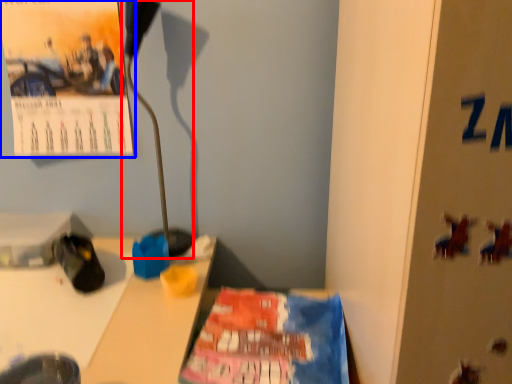
Question: Which point is closer to the camera, lamp (highlighted by a red box) or poster (highlighted by a blue box)?

Choices:
 (A) lamp
 (B) poster

Answer: (A)